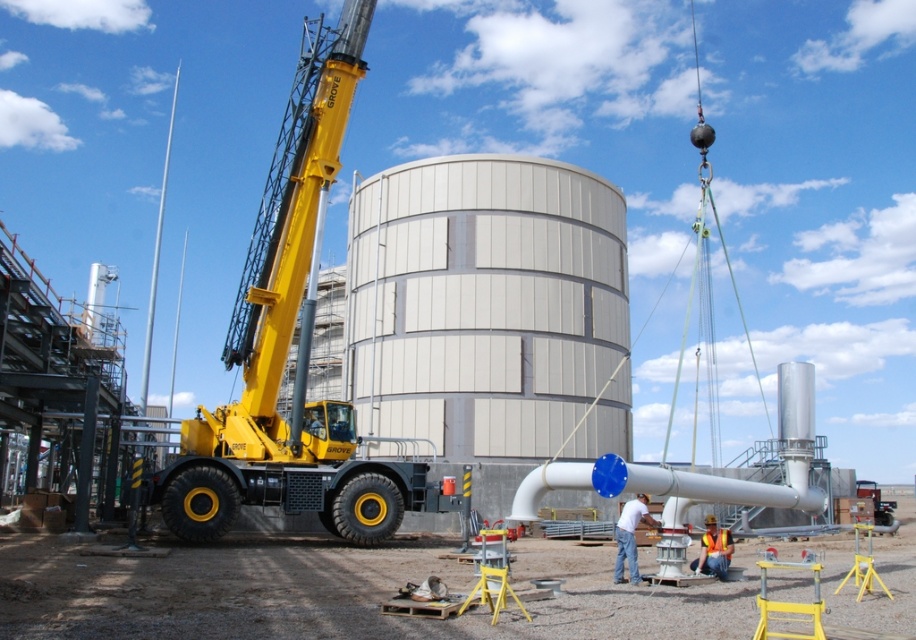
Question: Which point is closer to the camera?

Choices:
 (A) (705, 541)
 (B) (707, 496)

Answer: (B)

Question: Estimate the real-world distances between objects in this image. Which object is closer to the white matte shirt at lower center?

Choices:
 (A) yellow metallic crane at left
 (B) white smooth silo at center
 (C) white glossy pipe at center
 (D) orange reflective vest at lower center

Answer: (C)

Question: Can you confirm if white matte shirt at lower center is bigger than orange reflective vest at lower center?

Choices:
 (A) yes
 (B) no

Answer: (A)

Question: Which object appears farthest from the camera in this image?

Choices:
 (A) white glossy pipe at center
 (B) white smooth silo at center

Answer: (B)

Question: Is white smooth silo at center smaller than yellow metallic crane at left?

Choices:
 (A) yes
 (B) no

Answer: (B)

Question: Is the position of white smooth silo at center less distant than that of white matte shirt at lower center?

Choices:
 (A) no
 (B) yes

Answer: (A)